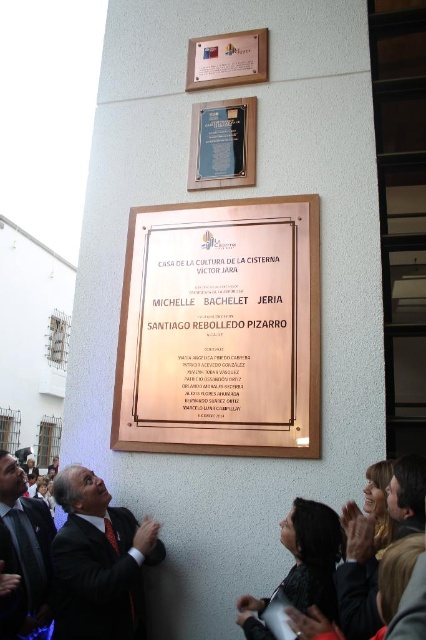
Question: Estimate the real-world distances between objects in this image. Which object is farther from the dark suit at lower left?

Choices:
 (A) matte black suit at center
 (B) black polished stone plaque at upper center
 (C) gold metallic plaque at upper center

Answer: (C)

Question: Where is dark suit at lower left located in relation to gold metallic plaque at upper center in the image?

Choices:
 (A) right
 (B) left

Answer: (B)

Question: Which of the following is the farthest from the observer?

Choices:
 (A) gold metallic plaque at upper center
 (B) dark suit at lower left
 (C) black polished stone plaque at upper center
 (D) bronze plaque at center

Answer: (A)

Question: Which object is closer to the camera taking this photo?

Choices:
 (A) bronze plaque at center
 (B) matte black suit at center
 (C) dark suit at lower left

Answer: (B)

Question: Can you confirm if matte black suit at center is positioned below gold metallic plaque at upper center?

Choices:
 (A) yes
 (B) no

Answer: (A)

Question: Is bronze plaque at center in front of gold metallic plaque at upper center?

Choices:
 (A) yes
 (B) no

Answer: (A)